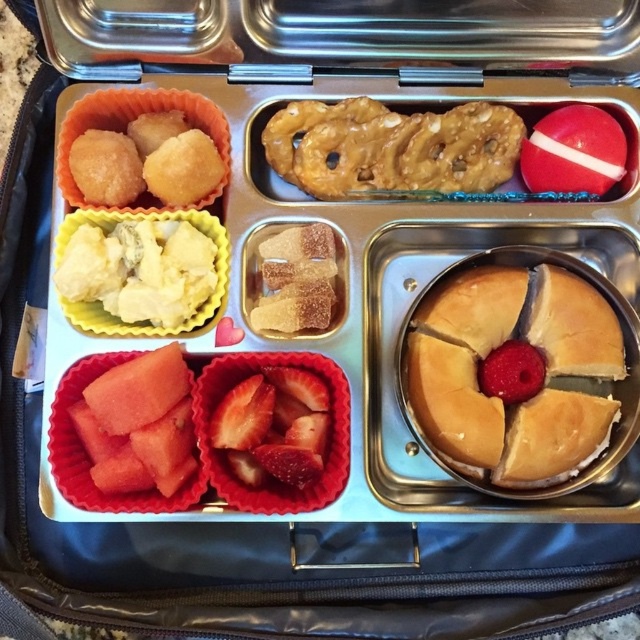
Between point (548, 380) and point (90, 99), which one is positioned in front?

Point (548, 380) is more forward.

Which is above, golden brown cake at center or matte yellow cupcake at upper left?

matte yellow cupcake at upper left is above.

Is point (483, 294) farther from viewer compared to point (61, 150)?

No, it is not.

You are a GUI agent. You are given a task and a screenshot of the screen. Output one action in this format:
    pyautogui.click(x=<x>, y=<y>)
    Task: Click on the golden brown cake at center
    The width and height of the screenshot is (640, 640).
    Given the screenshot: What is the action you would take?
    pyautogui.click(x=499, y=397)

Which is in front, point (541, 161) or point (541, 364)?

Positioned in front is point (541, 364).

Does shiny red apple at upper right have a lesser width compared to red matte raspberry at center?

In fact, shiny red apple at upper right might be wider than red matte raspberry at center.

Who is more forward, (x=563, y=118) or (x=502, y=348)?

Positioned in front is point (x=502, y=348).

Locate an element on the screen. shiny red apple at upper right is located at coordinates (573, 150).

Consider the image. Which is above, matte yellow cupcake at upper left or red matte raspberry at center?

matte yellow cupcake at upper left

How much distance is there between matte yellow cupcake at upper left and red matte raspberry at center?

matte yellow cupcake at upper left and red matte raspberry at center are 21.55 inches apart from each other.

Which is in front, point (144, 112) or point (509, 378)?

Positioned in front is point (509, 378).

You are a GUI agent. You are given a task and a screenshot of the screen. Output one action in this format:
    pyautogui.click(x=<x>, y=<y>)
    Task: Click on the matte yellow cupcake at upper left
    The width and height of the screenshot is (640, 640).
    Given the screenshot: What is the action you would take?
    pyautogui.click(x=131, y=120)